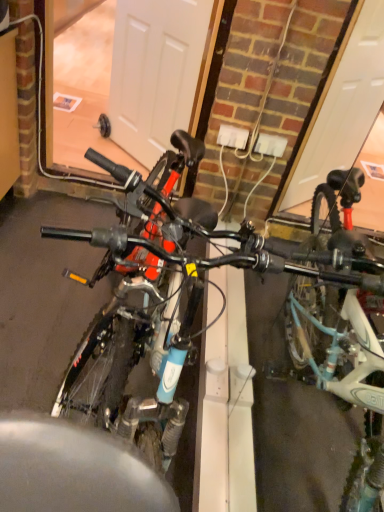
Question: Can you confirm if blue matte bicycle at center, the second bicycle viewed from the right, is thinner than white matte door at center?

Choices:
 (A) no
 (B) yes

Answer: (A)

Question: Is blue matte bicycle at center, which is the 1th bicycle in left-to-right order, positioned behind white matte door at center?

Choices:
 (A) no
 (B) yes

Answer: (A)

Question: Is blue matte bicycle at center, the second bicycle viewed from the right, surrounding white matte door at center?

Choices:
 (A) yes
 (B) no

Answer: (B)

Question: Can you see blue matte bicycle at center, which is the 1th bicycle in left-to-right order, touching white matte door at center?

Choices:
 (A) no
 (B) yes

Answer: (A)

Question: Is blue matte bicycle at center, which is the 1th bicycle in left-to-right order, bigger than white matte door at center?

Choices:
 (A) yes
 (B) no

Answer: (A)

Question: Is teal matte bicycle at right, which ranks as the 1th bicycle in right-to-left order, to the left or to the right of white matte door at center in the image?

Choices:
 (A) left
 (B) right

Answer: (B)

Question: From a real-world perspective, is teal matte bicycle at right, which ranks as the 1th bicycle in right-to-left order, above or below white matte door at center?

Choices:
 (A) above
 (B) below

Answer: (A)

Question: From the image's perspective, relative to white matte door at center, is teal matte bicycle at right, which ranks as the 1th bicycle in right-to-left order, above or below?

Choices:
 (A) below
 (B) above

Answer: (A)

Question: In terms of height, does teal matte bicycle at right, which ranks as the 1th bicycle in right-to-left order, look taller or shorter compared to white matte door at center?

Choices:
 (A) tall
 (B) short

Answer: (B)

Question: Considering the positions of blue matte bicycle at center, which is the 1th bicycle in left-to-right order, and teal matte bicycle at right, which ranks as the 1th bicycle in right-to-left order, in the image, is blue matte bicycle at center, which is the 1th bicycle in left-to-right order, taller or shorter than teal matte bicycle at right, which ranks as the 1th bicycle in right-to-left order,?

Choices:
 (A) tall
 (B) short

Answer: (B)

Question: Based on their positions, is blue matte bicycle at center, which is the 1th bicycle in left-to-right order, located to the left or right of teal matte bicycle at right, which ranks as the 1th bicycle in right-to-left order?

Choices:
 (A) right
 (B) left

Answer: (B)

Question: From a real-world perspective, relative to teal matte bicycle at right, placed as the second bicycle when sorted from left to right, is blue matte bicycle at center, the second bicycle viewed from the right, vertically above or below?

Choices:
 (A) below
 (B) above

Answer: (A)

Question: Is blue matte bicycle at center, the second bicycle viewed from the right, in front of or behind teal matte bicycle at right, placed as the second bicycle when sorted from left to right, in the image?

Choices:
 (A) behind
 (B) front

Answer: (A)

Question: In terms of size, does blue matte bicycle at center, which is the 1th bicycle in left-to-right order, appear bigger or smaller than white matte door at center?

Choices:
 (A) small
 (B) big

Answer: (B)

Question: Is blue matte bicycle at center, which is the 1th bicycle in left-to-right order, inside the boundaries of white matte door at center, or outside?

Choices:
 (A) outside
 (B) inside

Answer: (A)